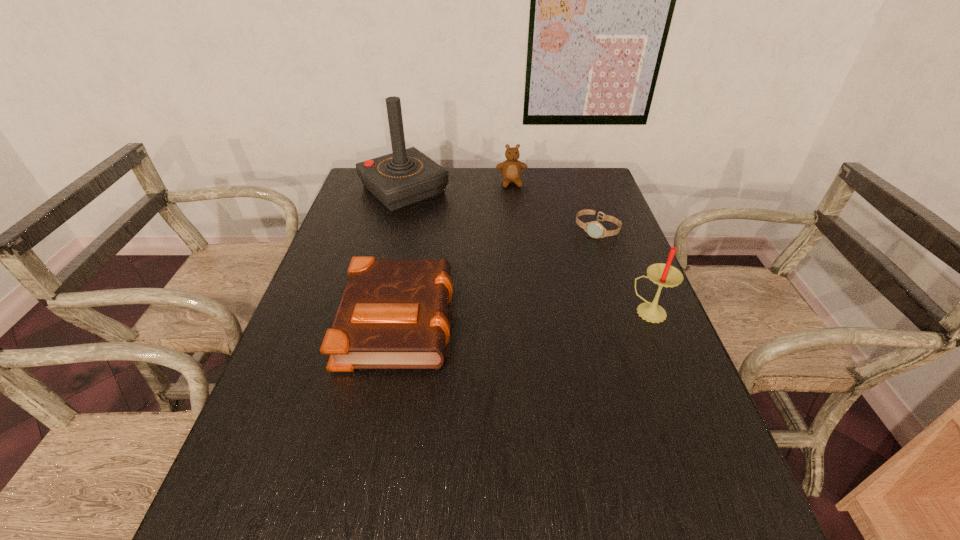
The width and height of the screenshot is (960, 540). Identify the location of empty space between the third farthest object and the fourth tallest object. (498, 274).

I want to click on vacant point located between the third nearest object and the third tallest object, so click(554, 206).

Where is `free area in between the joystick and the third object from right to left`? The width and height of the screenshot is (960, 540). free area in between the joystick and the third object from right to left is located at coordinates (458, 186).

This screenshot has width=960, height=540. I want to click on free point between the third nearest object and the tallest object, so click(500, 210).

Locate an element on the screen. The height and width of the screenshot is (540, 960). free space that is in between the fourth shortest object and the third shortest object is located at coordinates (581, 248).

Locate an element on the screen. This screenshot has height=540, width=960. free space between the second tallest object and the joystick is located at coordinates (527, 251).

Where is `vacant area that lies between the fourth tallest object and the watch`? The width and height of the screenshot is (960, 540). vacant area that lies between the fourth tallest object and the watch is located at coordinates (498, 274).

The height and width of the screenshot is (540, 960). In order to click on free space between the third shortest object and the third farthest object in this screenshot , I will do `click(554, 206)`.

You are a GUI agent. You are given a task and a screenshot of the screen. Output one action in this format:
    pyautogui.click(x=<x>, y=<y>)
    Task: Click on the free spot between the teddy bear and the joystick
    This screenshot has height=540, width=960.
    Given the screenshot: What is the action you would take?
    pyautogui.click(x=458, y=186)

Locate an element on the screen. This screenshot has height=540, width=960. free space between the candle and the third object from left to right is located at coordinates (581, 248).